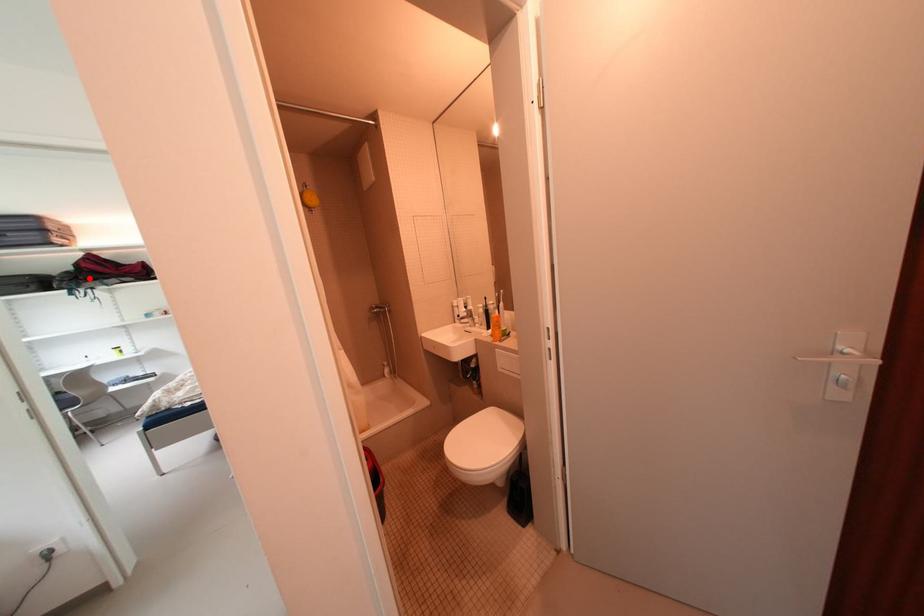
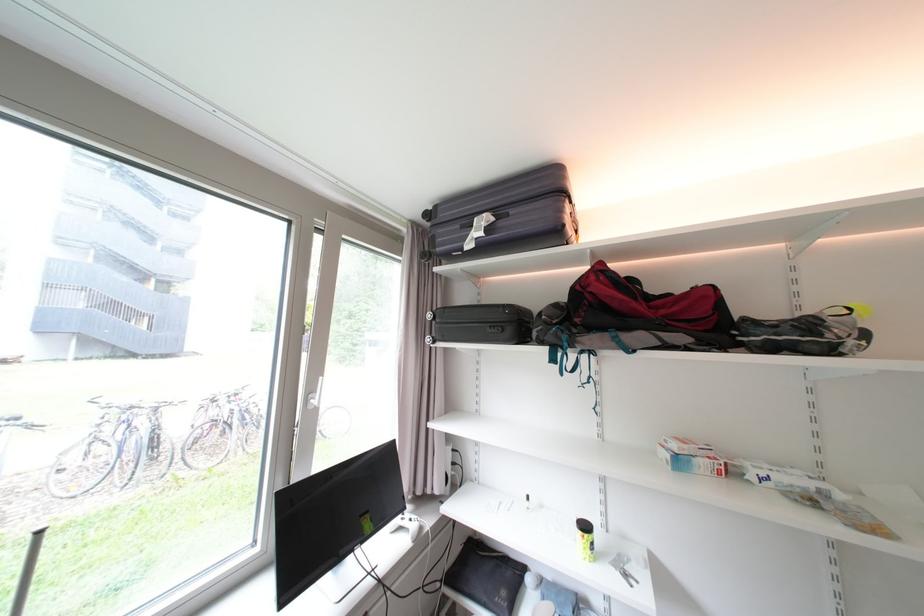
The point at the highlighted location is marked in the first image. Where is the corresponding point in the second image?

(585, 322)